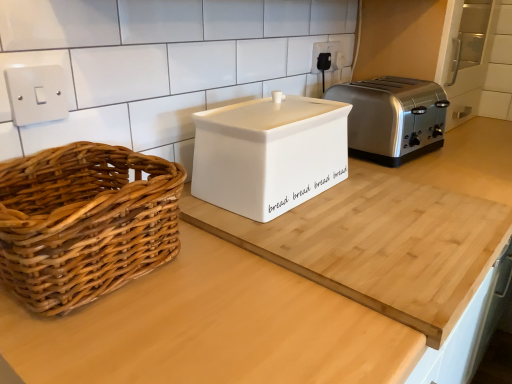
Question: Are white ceramic bread bin at center and white plastic electrical outlet at upper center located far from each other?

Choices:
 (A) yes
 (B) no

Answer: (B)

Question: Considering the relative positions of white ceramic bread bin at center and white plastic electrical outlet at upper center in the image provided, is white ceramic bread bin at center to the right of white plastic electrical outlet at upper center from the viewer's perspective?

Choices:
 (A) yes
 (B) no

Answer: (B)

Question: Can you confirm if white ceramic bread bin at center is shorter than white plastic electrical outlet at upper center?

Choices:
 (A) yes
 (B) no

Answer: (B)

Question: Considering the relative sizes of white ceramic bread bin at center and white plastic electrical outlet at upper center in the image provided, is white ceramic bread bin at center bigger than white plastic electrical outlet at upper center?

Choices:
 (A) yes
 (B) no

Answer: (A)

Question: Is white ceramic bread bin at center taller than white plastic electrical outlet at upper center?

Choices:
 (A) no
 (B) yes

Answer: (B)

Question: Is white ceramic bread bin at center positioned beyond the bounds of white plastic electrical outlet at upper center?

Choices:
 (A) no
 (B) yes

Answer: (B)

Question: Does white plastic electrical outlet at upper center have a lesser width compared to white ceramic bread bin at center?

Choices:
 (A) no
 (B) yes

Answer: (B)

Question: From the image's perspective, is white plastic electrical outlet at upper center on top of white ceramic bread bin at center?

Choices:
 (A) yes
 (B) no

Answer: (A)

Question: Is white plastic electrical outlet at upper center to the right of white ceramic bread bin at center from the viewer's perspective?

Choices:
 (A) yes
 (B) no

Answer: (A)

Question: Is white plastic electrical outlet at upper center outside white ceramic bread bin at center?

Choices:
 (A) yes
 (B) no

Answer: (A)

Question: From a real-world perspective, is white plastic electrical outlet at upper center beneath white ceramic bread bin at center?

Choices:
 (A) no
 (B) yes

Answer: (A)

Question: Does white plastic electrical outlet at upper center have a smaller size compared to white ceramic bread bin at center?

Choices:
 (A) yes
 (B) no

Answer: (A)

Question: Is white matte bread bin at center to the right of satin silver toaster at right from the viewer's perspective?

Choices:
 (A) no
 (B) yes

Answer: (A)